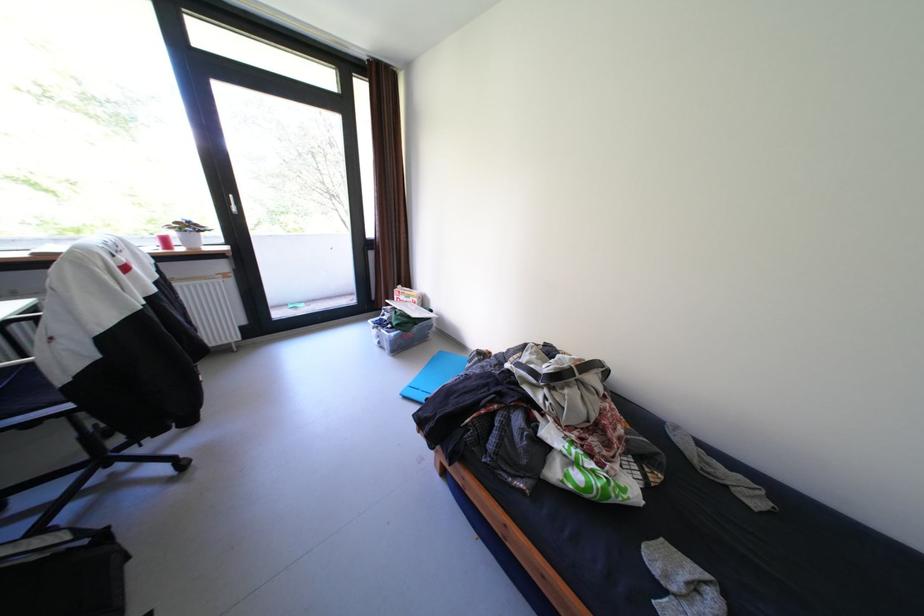
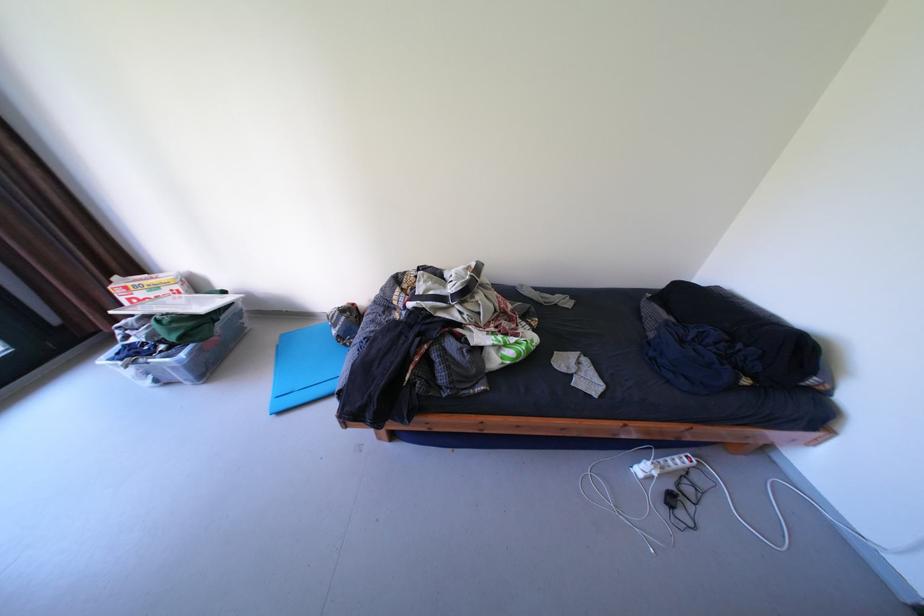
In the second image, find the point that corresponds to [427,300] in the first image.

(188, 286)